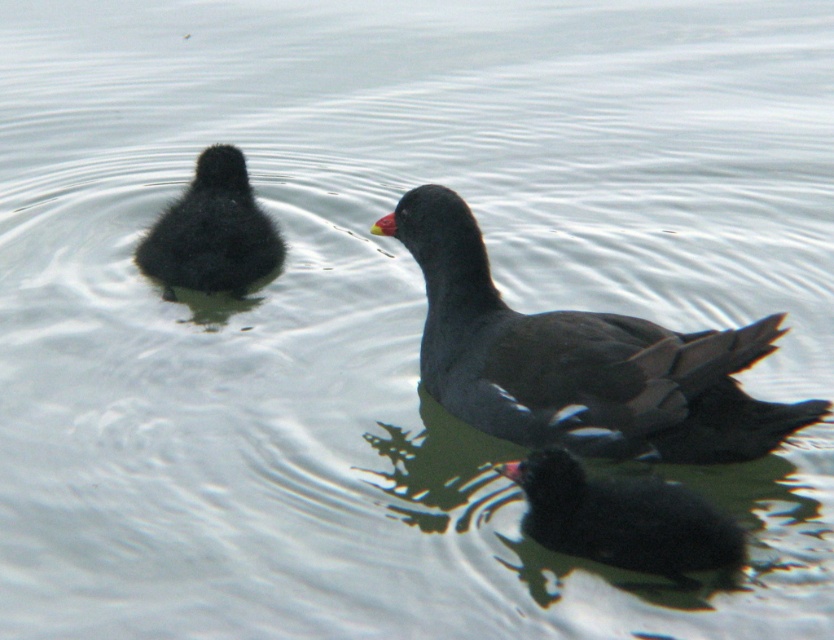
Is point (594, 330) positioned in front of point (254, 232)?

Yes, it is in front of point (254, 232).

Is dark gray matte duck at center thinner than black matte duckling at upper left?

Incorrect, dark gray matte duck at center's width is not less than black matte duckling at upper left's.

Does point (636, 358) come in front of point (257, 280)?

Yes, it is in front of point (257, 280).

Find the location of a particular element. dark gray matte duck at center is located at coordinates (579, 360).

Is point (721, 556) positioned in front of point (183, 227)?

Yes, point (721, 556) is closer to viewer.

Is point (583, 518) positioned before point (208, 280)?

That is True.

The width and height of the screenshot is (834, 640). Identify the location of black matte duckling at lower right. click(x=621, y=516).

Which of these two, dark gray matte duck at center or black matte duckling at lower right, stands shorter?

With less height is black matte duckling at lower right.

Which is behind, point (436, 236) or point (546, 513)?

Point (436, 236)

You are a GUI agent. You are given a task and a screenshot of the screen. Output one action in this format:
    pyautogui.click(x=<x>, y=<y>)
    Task: Click on the dark gray matte duck at center
    This screenshot has height=640, width=834.
    Given the screenshot: What is the action you would take?
    pyautogui.click(x=579, y=360)